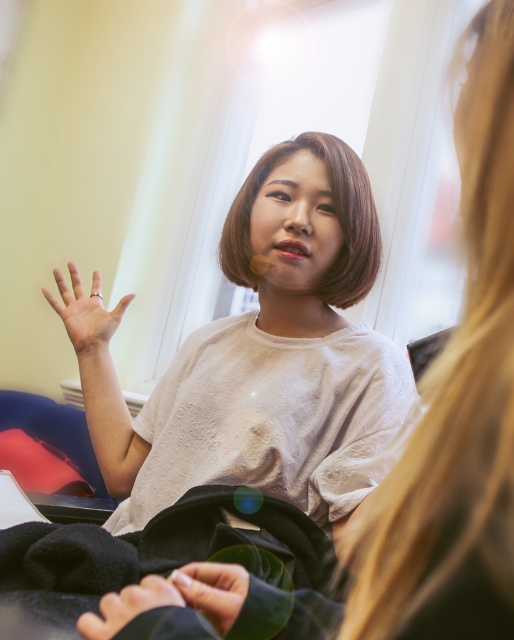
Does white matte shirt at center lie behind silver metallic ring at center?

No, it is not.

The width and height of the screenshot is (514, 640). What are the coordinates of `white matte shirt at center` in the screenshot? It's located at (262, 356).

Which is in front, point (248, 262) or point (238, 605)?

Point (238, 605) is in front.

Between point (338, 378) and point (242, 595), which one is positioned in front?

Point (242, 595)

Where is `white matte shirt at center`? This screenshot has width=514, height=640. white matte shirt at center is located at coordinates (262, 356).

Is smooth black fabric at lower center taller than smooth black hand at center?

No, smooth black fabric at lower center is not taller than smooth black hand at center.

Is smooth black fabric at lower center to the right of smooth black hand at center from the viewer's perspective?

Yes, smooth black fabric at lower center is to the right of smooth black hand at center.

What are the coordinates of `smooth black fabric at lower center` in the screenshot? It's located at (212, 589).